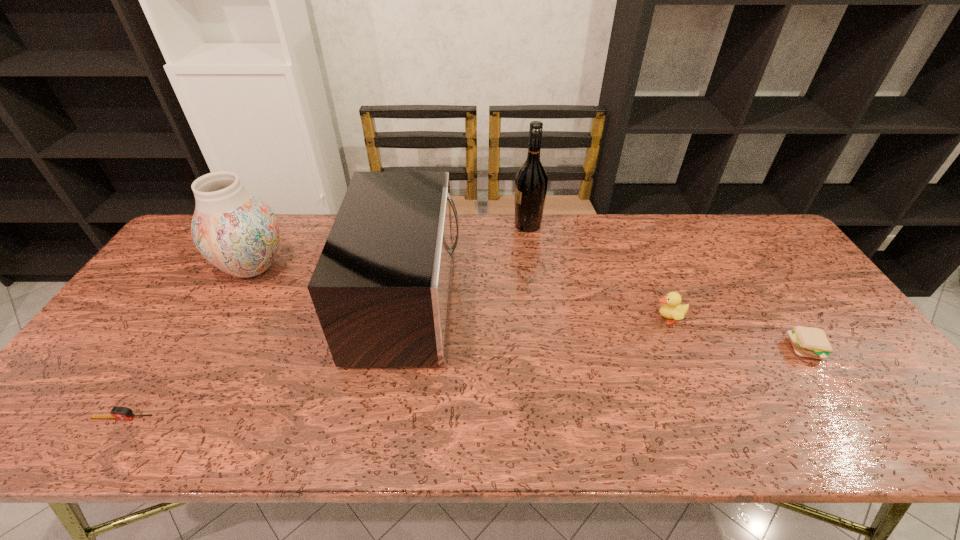
This screenshot has height=540, width=960. I want to click on free location at the right edge, so click(780, 307).

Where is `vacant region between the microwave oven and the fifth object from left to right`? vacant region between the microwave oven and the fifth object from left to right is located at coordinates (538, 310).

You are a GUI agent. You are given a task and a screenshot of the screen. Output one action in this format:
    pyautogui.click(x=<x>, y=<y>)
    Task: Click on the free spot between the fifth tallest object and the fourth tallest object
    This screenshot has height=540, width=960.
    Given the screenshot: What is the action you would take?
    [x=737, y=334]

At what (x,y) coordinates should I click in order to perform the action: click on vacant space that is in between the duckling and the rightmost object. Please return your answer as a coordinate pair (x, y). The height and width of the screenshot is (540, 960). Looking at the image, I should click on (737, 334).

Where is `vacant point located between the microwave oven and the tallest object`? The height and width of the screenshot is (540, 960). vacant point located between the microwave oven and the tallest object is located at coordinates (468, 264).

Locate an element on the screen. The height and width of the screenshot is (540, 960). vacant area that lies between the duckling and the shortest object is located at coordinates (396, 368).

Find the location of `free space that is in between the fourth object from right to left and the tape measure`. free space that is in between the fourth object from right to left and the tape measure is located at coordinates (266, 360).

This screenshot has width=960, height=540. What are the coordinates of `empty space between the fifth object from left to right and the patty` in the screenshot? It's located at (737, 334).

This screenshot has width=960, height=540. I want to click on unoccupied position between the vase and the tape measure, so click(x=188, y=342).

Where is `free space between the vase and the rightmost object`? Image resolution: width=960 pixels, height=540 pixels. free space between the vase and the rightmost object is located at coordinates (530, 308).